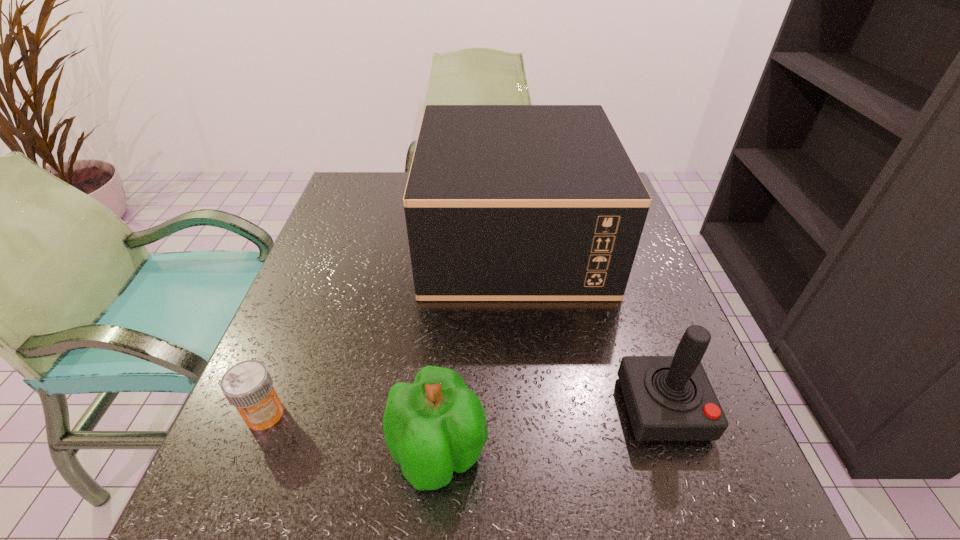
The width and height of the screenshot is (960, 540). Find the location of `vacant space at the right edge of the desktop`. vacant space at the right edge of the desktop is located at coordinates (668, 456).

The width and height of the screenshot is (960, 540). In the image, there is a desktop. Identify the location of vacant space at the far left corner. (391, 202).

The height and width of the screenshot is (540, 960). I want to click on free area in between the shortest object and the bell pepper, so (351, 434).

What are the coordinates of `empty space that is in between the medicine and the bell pepper` in the screenshot? It's located at (351, 434).

I want to click on empty space that is in between the joystick and the tallest object, so click(x=588, y=323).

Locate an element on the screen. vacant area between the bell pepper and the box is located at coordinates (476, 347).

You are a GUI agent. You are given a task and a screenshot of the screen. Output one action in this format:
    pyautogui.click(x=<x>, y=<y>)
    Task: Click on the vacant area that lies between the tallest object and the bell pepper
    This screenshot has height=540, width=960.
    Given the screenshot: What is the action you would take?
    pyautogui.click(x=476, y=347)

The width and height of the screenshot is (960, 540). What are the coordinates of `free space between the shortest object and the bell pepper` in the screenshot? It's located at (351, 434).

I want to click on object that is the nearest to the box, so click(x=669, y=398).

Locate which object is the third closest to the farthest object. Please provide its 2D coordinates. Your answer should be formatted as a tuple, i.e. [(x, y)], where the tuple contains the x and y coordinates of a point satisfying the conditions above.

[(248, 386)]